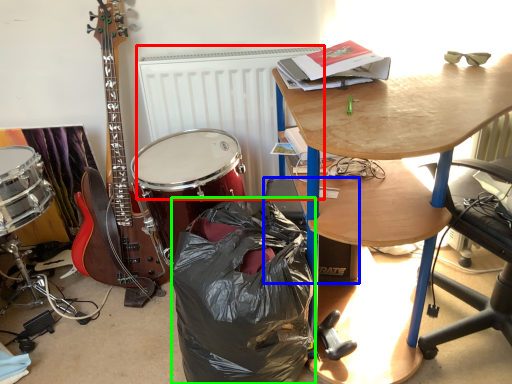
Question: Based on their relative distances, which object is farther from radiator (highlighted by a red box)? Choose from loudspeaker (highlighted by a blue box) and trash bin/can (highlighted by a green box).

Choices:
 (A) loudspeaker
 (B) trash bin/can

Answer: (B)